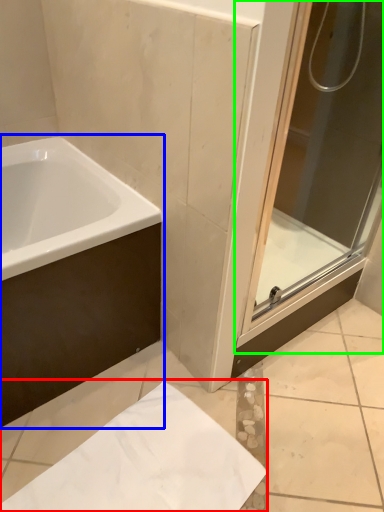
Question: Estimate the real-world distances between objects in this image. Which object is closer to paper (highlighted by a red box), bathtub (highlighted by a blue box) or screen door (highlighted by a green box)?

Choices:
 (A) bathtub
 (B) screen door

Answer: (A)